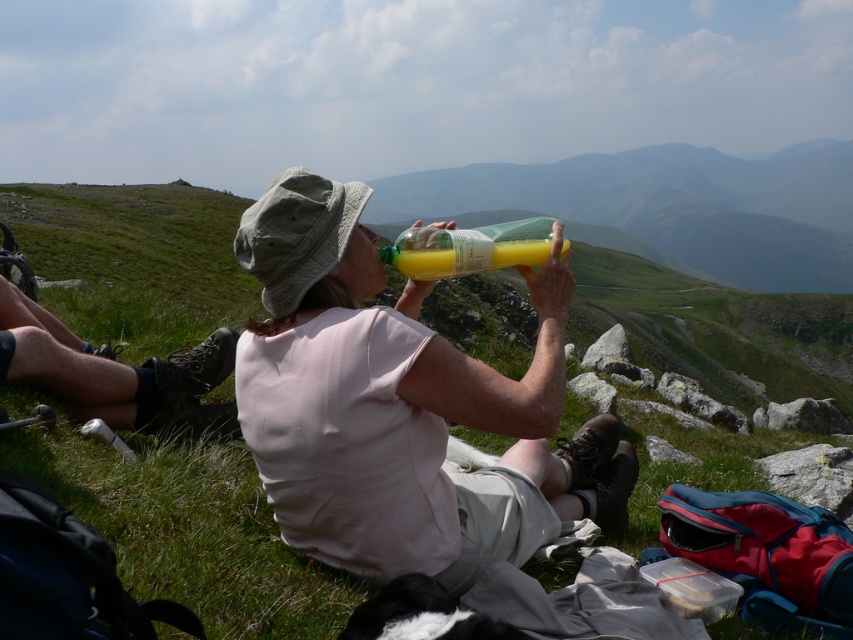
You are a photographer trying to capture the exact location of the matte plastic bottle at center in the image. According to the coordinates provided, where would you focus your camera to ensure the bottle is centered in the frame?

The matte plastic bottle at center is located at coordinates point (401, 404), so you should focus your camera on that exact point to center it in the frame.

You are a photographer trying to capture the scene of a person resting on a hillside. You notice the matte plastic bottle at center and the khaki fabric hat at center. Which object is positioned lower in the image?

The matte plastic bottle at center is positioned below the khaki fabric hat at center, so the matte plastic bottle at center is lower in the image.